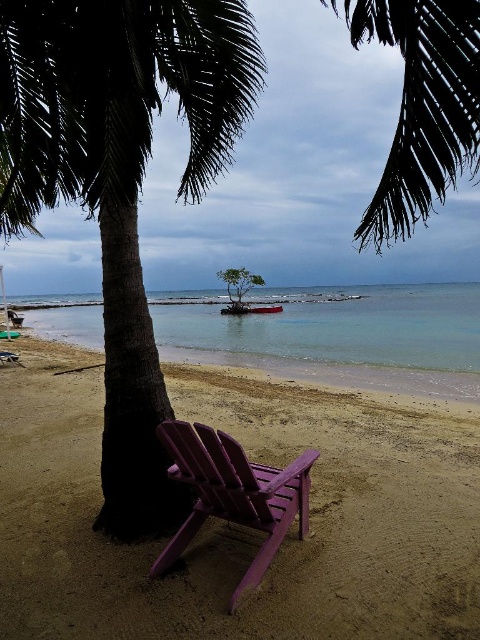
Which is behind, point (256, 93) or point (244, 284)?

The point (256, 93) is behind.

Is the position of dark green leafy palm tree at center less distant than that of green leafy tree at center?

That is True.

Does point (191, 92) lie in front of point (247, 282)?

Yes, point (191, 92) is closer to viewer.

Locate an element on the screen. This screenshot has width=480, height=640. dark green leafy palm tree at center is located at coordinates [x=120, y=180].

Who is more distant from viewer, (108, 456) or (454, 33)?

The point (108, 456) is more distant.

Which of these two, dark green leafy palm tree at center or silhouette leafy palm at upper center, stands shorter?

dark green leafy palm tree at center is shorter.

Image resolution: width=480 pixels, height=640 pixels. In order to click on dark green leafy palm tree at center in this screenshot , I will do `click(120, 180)`.

Where is `dark green leafy palm tree at center`? dark green leafy palm tree at center is located at coordinates (120, 180).

Based on the photo, between purple wood beach chair at lower center and wooden boat at center, which one is positioned higher?

wooden boat at center is higher up.

What do you see at coordinates (232, 493) in the screenshot?
I see `purple wood beach chair at lower center` at bounding box center [232, 493].

The width and height of the screenshot is (480, 640). I want to click on purple wood beach chair at lower center, so click(232, 493).